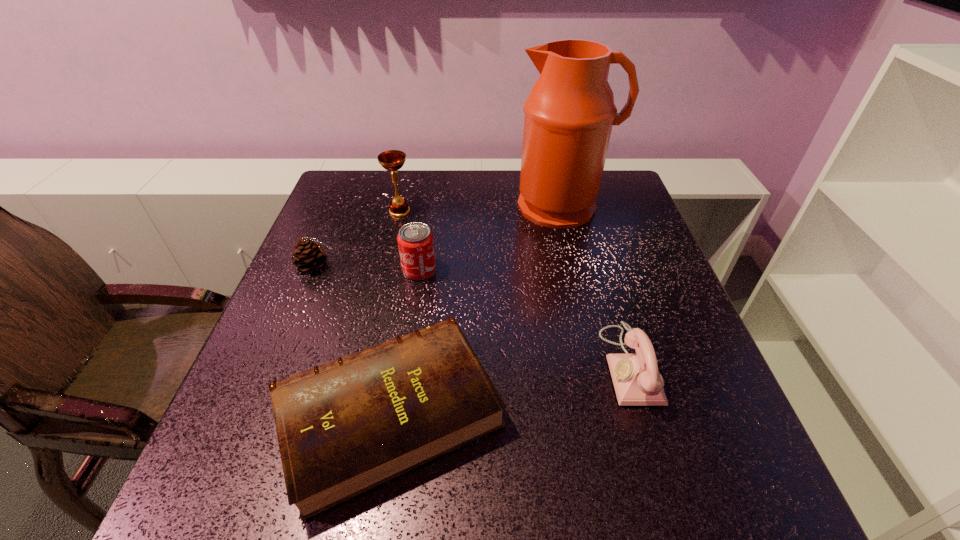
Find the location of a particular element. Image resolution: width=960 pixels, height=540 pixels. telephone that is at the right edge is located at coordinates (636, 378).

Image resolution: width=960 pixels, height=540 pixels. What are the coordinates of `object at the near left corner` in the screenshot? It's located at (344, 427).

Where is `object located at the far right corner`? This screenshot has width=960, height=540. object located at the far right corner is located at coordinates 569,114.

You are a GUI agent. You are given a task and a screenshot of the screen. Output one action in this format:
    pyautogui.click(x=<x>, y=<y>)
    Task: Click on the vacant space at the far edge of the desktop
    The image size is (960, 540).
    Given the screenshot: What is the action you would take?
    pyautogui.click(x=429, y=177)

Locate an element on the screen. vacant region at the near edge of the desktop is located at coordinates (417, 492).

In the image, there is a desktop. Identify the location of free space at the left edge. The height and width of the screenshot is (540, 960). (346, 247).

In the image, there is a desktop. At what (x,y) coordinates should I click in order to perform the action: click on vacant space at the right edge. Please return your answer as a coordinate pair (x, y). Looking at the image, I should click on (643, 252).

At what (x,y) coordinates should I click in order to perform the action: click on vacant space at the near left corner of the desktop. Please return your answer as a coordinate pair (x, y). The width and height of the screenshot is (960, 540). Looking at the image, I should click on point(225,505).

What are the coordinates of `vacant space that's between the telephone and the pinecone` in the screenshot? It's located at (472, 315).

At what (x,y) coordinates should I click in order to perform the action: click on vacant space that is in between the chalice and the water jug. Please return your answer as a coordinate pair (x, y). The image size is (960, 540). Looking at the image, I should click on (481, 209).